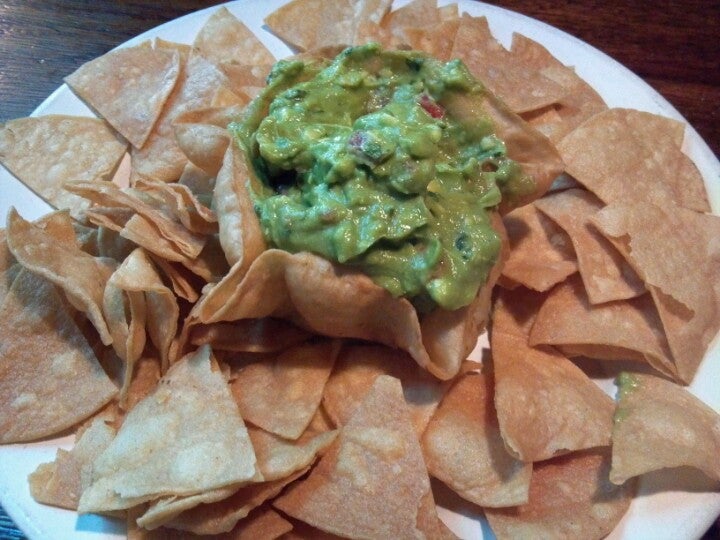
Identify the location of edge of the plate. (19, 507).